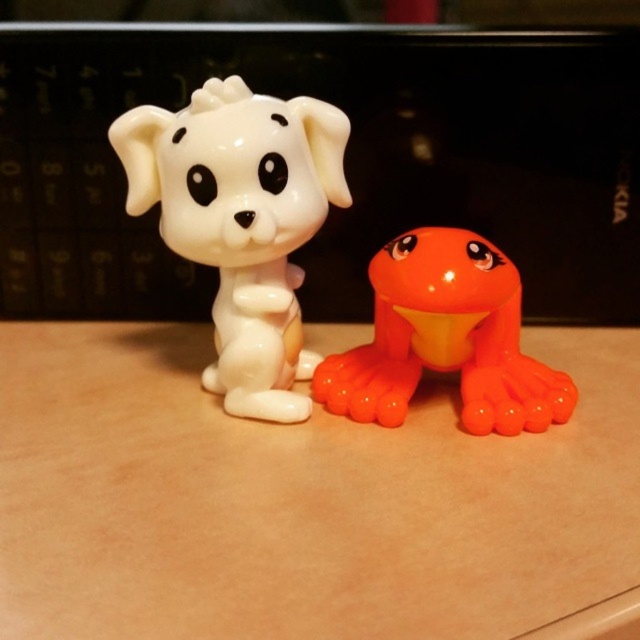
Is point (234, 312) more distant than point (424, 339)?

Yes.

Is white glossy dog at center above orange glossy frog at center?

Yes.

Where is `white glossy dog at center`? Image resolution: width=640 pixels, height=640 pixels. white glossy dog at center is located at coordinates (241, 221).

Identify the location of white glossy dog at center. This screenshot has width=640, height=640. (241, 221).

Does matte plastic table at center have a lesser width compared to orange glossy frog at center?

Incorrect, matte plastic table at center's width is not less than orange glossy frog at center's.

Based on the photo, who is positioned more to the left, matte plastic table at center or orange glossy frog at center?

Positioned to the left is matte plastic table at center.

What are the coordinates of `matte plastic table at center` in the screenshot? It's located at (305, 500).

Between matte plastic table at center and white glossy dog at center, which one has less height?

Standing shorter between the two is matte plastic table at center.

Who is lower down, matte plastic table at center or white glossy dog at center?

matte plastic table at center is lower down.

Measure the distance between point (x=308, y=592) and camera.

Point (x=308, y=592) is 92.79 centimeters away from camera.

Image resolution: width=640 pixels, height=640 pixels. Find the location of `matte plastic table at center`. matte plastic table at center is located at coordinates [x=305, y=500].